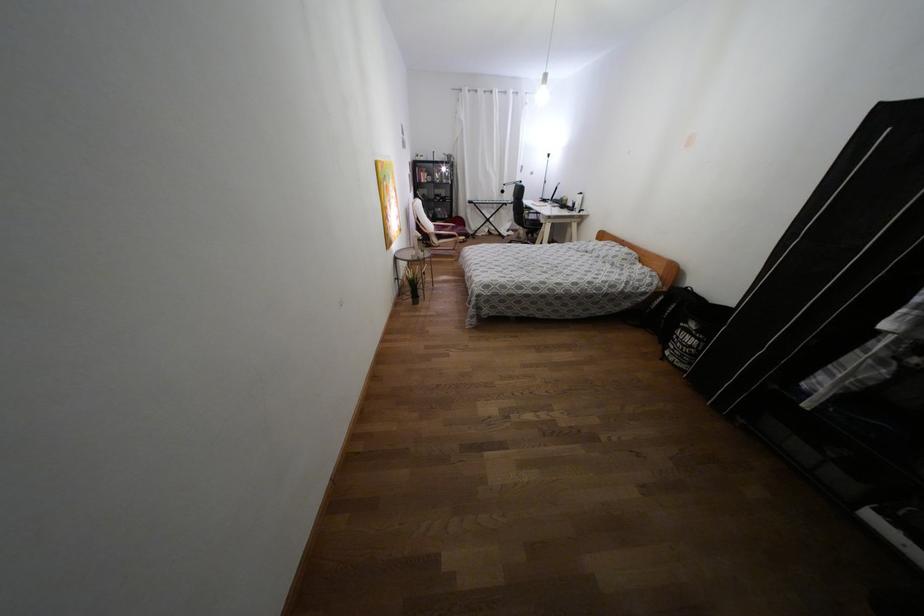
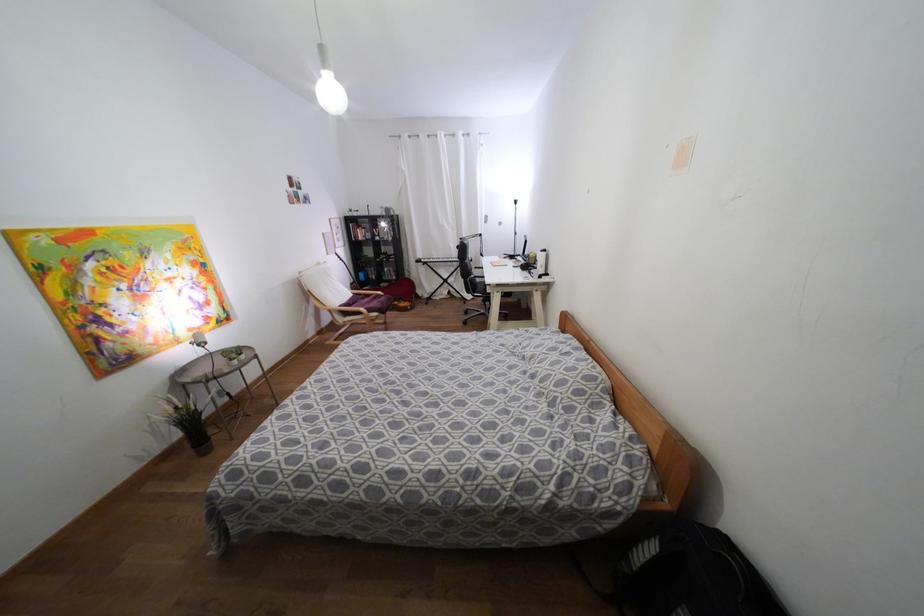
In the second image, find the point that corresponds to [439,237] in the first image.

(344, 313)